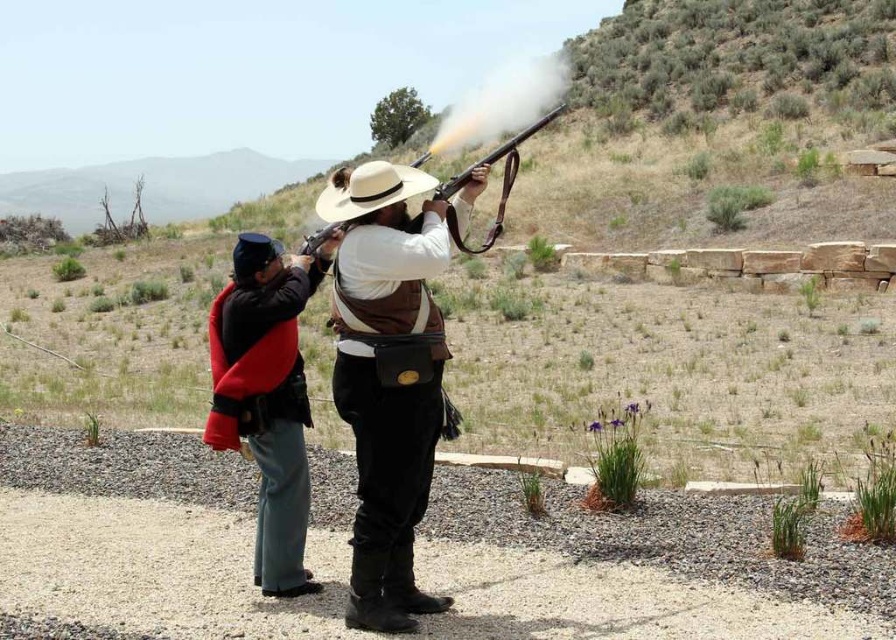
Is point (273, 278) positioned behind point (523, 140)?

No, (273, 278) is in front of (523, 140).

Is red wool coat at center thinner than matte brown shotgun at center?

Correct, red wool coat at center's width is less than matte brown shotgun at center's.

Which is in front, point (285, 593) or point (438, 189)?

Point (438, 189)

Find the location of `red wool coat at center`. red wool coat at center is located at coordinates (266, 397).

Which is above, brown leather vest at center or red wool coat at center?

brown leather vest at center is higher up.

Can you confirm if brown leather vest at center is shorter than red wool coat at center?

Yes, brown leather vest at center is shorter than red wool coat at center.

Image resolution: width=896 pixels, height=640 pixels. I want to click on brown leather vest at center, so click(386, 378).

Can you confirm if white felt cowboy hat at center is wider than wooden smooth rifle at center?

Yes.

Is point (332, 211) closer to viewer compared to point (298, 252)?

Yes.

Identify the location of white felt cowboy hat at center. This screenshot has width=896, height=640. click(369, 189).